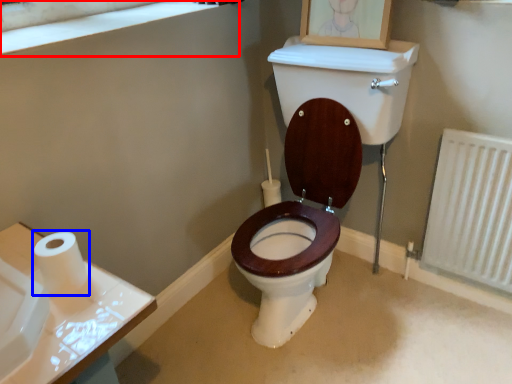
Question: Which point is closer to the camera, window frame (highlighted by a red box) or toilet paper (highlighted by a blue box)?

Choices:
 (A) window frame
 (B) toilet paper

Answer: (B)